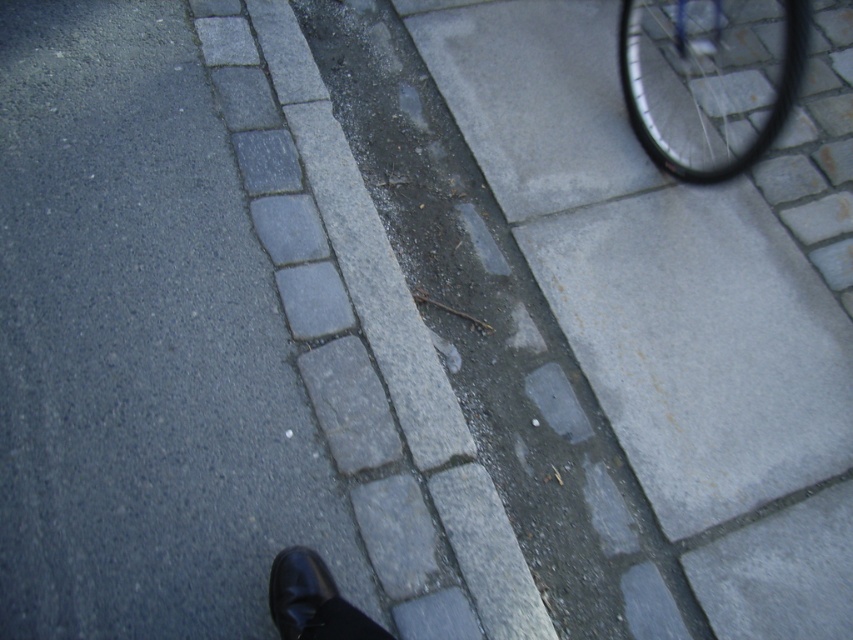
Question: Is gray stone curb at center to the right of shiny metallic wheel at upper right from the viewer's perspective?

Choices:
 (A) yes
 (B) no

Answer: (B)

Question: Does gray stone curb at center appear over black leather shoe at lower left?

Choices:
 (A) yes
 (B) no

Answer: (A)

Question: Does shiny metallic wheel at upper right have a larger size compared to black leather shoe at lower left?

Choices:
 (A) yes
 (B) no

Answer: (A)

Question: Which object is farther from the camera taking this photo?

Choices:
 (A) gray stone curb at center
 (B) shiny metallic wheel at upper right

Answer: (B)

Question: Which point appears closest to the camera in this image?

Choices:
 (A) (688, 152)
 (B) (315, 602)

Answer: (B)

Question: Estimate the real-world distances between objects in this image. Which object is farther from the shiny metallic wheel at upper right?

Choices:
 (A) black leather shoe at lower left
 (B) gray stone curb at center

Answer: (A)